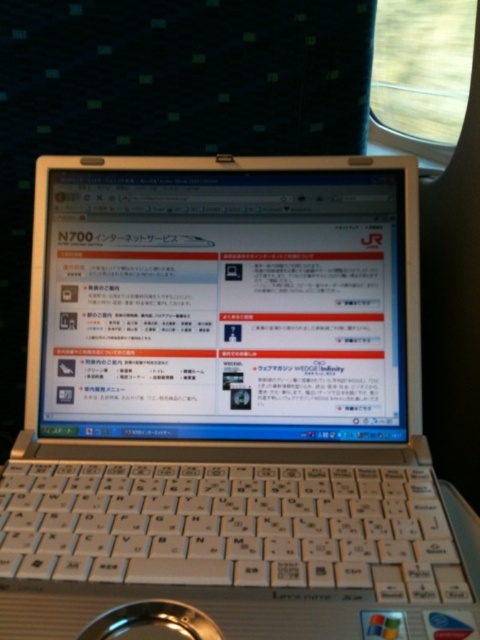
Question: Does white glossy laptop at center appear on the left side of metallic silver magnifying glass at lower center?

Choices:
 (A) yes
 (B) no

Answer: (B)

Question: Can you confirm if white glossy laptop at center is positioned to the right of metallic silver magnifying glass at lower center?

Choices:
 (A) yes
 (B) no

Answer: (A)

Question: Based on their relative distances, which object is nearer to the white glossy laptop at center?

Choices:
 (A) white plastic keyboard at center
 (B) metallic silver magnifying glass at lower center

Answer: (A)

Question: Based on their relative distances, which object is farther from the metallic silver magnifying glass at lower center?

Choices:
 (A) white plastic keyboard at center
 (B) white glossy laptop at center

Answer: (B)

Question: Is the position of white plastic keyboard at center more distant than that of metallic silver magnifying glass at lower center?

Choices:
 (A) no
 (B) yes

Answer: (B)

Question: Which of the following is the farthest from the observer?

Choices:
 (A) (249, 288)
 (B) (300, 586)

Answer: (A)